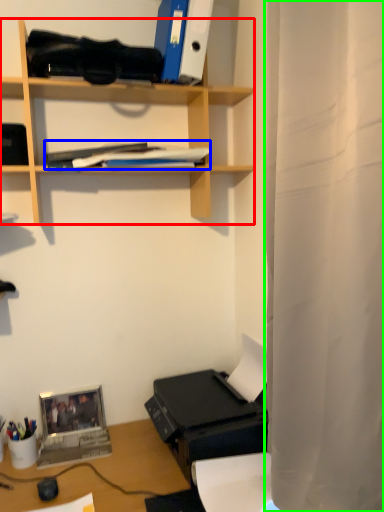
Question: Which object is positioned closest to shelf (highlighted by a red box)? Select from book (highlighted by a blue box) and shower curtain (highlighted by a green box).

Choices:
 (A) book
 (B) shower curtain

Answer: (A)